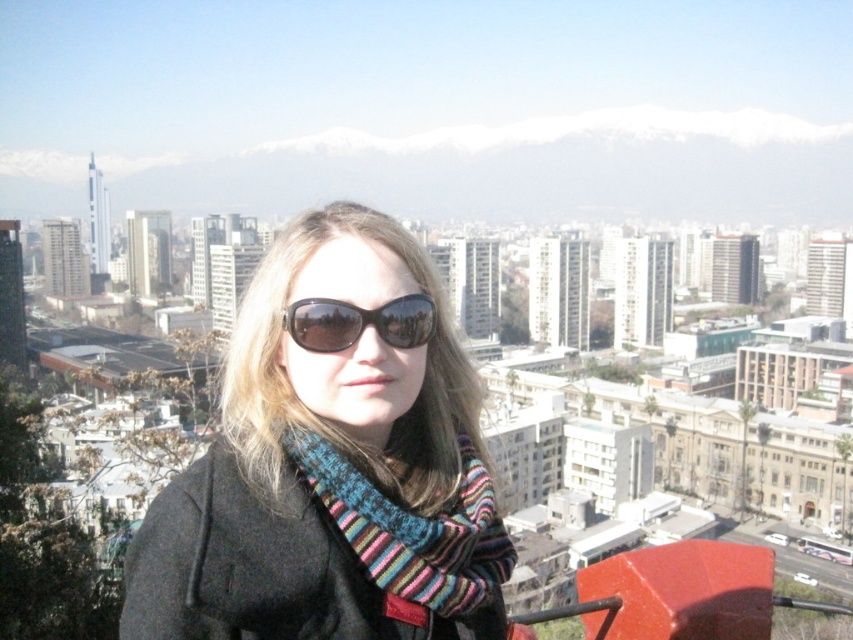
You are a photographer trying to capture a closeup of the striped knit scarf at center and the black plastic sunglasses at center. Since you want to focus on both items equally, which one should you zoom in on more to ensure they appear the same size in the photo?

The striped knit scarf at center is bigger than the black plastic sunglasses at center, so you should zoom in more on the black plastic sunglasses at center to make them appear the same size as the scarf.

You are a photographer who wants to capture the black knitted scarf at center and the striped knit scarf at center in a single shot. Since both are at the center, can you tell which one is closer to the camera?

The black knitted scarf at center is located above the striped knit scarf at center, so it is closer to the camera.

You are a photographer trying to capture the cityscape behind the person. You notice the striped knit scarf at center and the black plastic sunglasses at center. Which object should you adjust in your frame to ensure the cityscape is fully visible?

The striped knit scarf at center is much taller than the black plastic sunglasses at center, so adjusting the frame to move the striped knit scarf at center lower would help ensure the cityscape is fully visible.